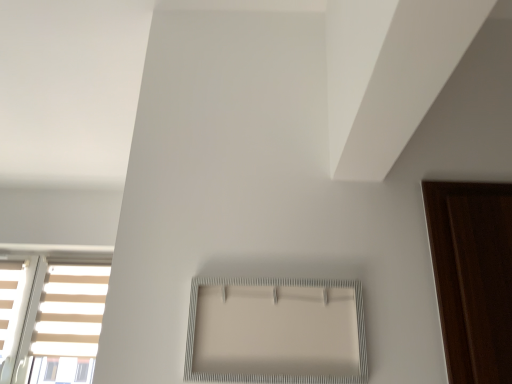
Question: Does white striped window at lower left, positioned as the 1th window in left-to-right order, come in front of white textured frame at center, which is counted as the second window, starting from the bottom?

Choices:
 (A) no
 (B) yes

Answer: (A)

Question: Can you confirm if white striped window at lower left, the 2th window viewed from the front, is smaller than white textured frame at center, which ranks as the 2th window in left-to-right order?

Choices:
 (A) yes
 (B) no

Answer: (B)

Question: Does white striped window at lower left, which is the 2th window from right to left, turn towards white textured frame at center, the 2th window from the back?

Choices:
 (A) yes
 (B) no

Answer: (B)

Question: From a real-world perspective, does white striped window at lower left, placed as the 1th window when sorted from bottom to top, sit lower than white textured frame at center, which ranks as the 2th window in left-to-right order?

Choices:
 (A) no
 (B) yes

Answer: (A)

Question: From the image's perspective, is white striped window at lower left, which is the 2th window from right to left, above white textured frame at center, which ranks as the first window in right-to-left order?

Choices:
 (A) no
 (B) yes

Answer: (A)

Question: Is white striped window at lower left, positioned as the 1th window in left-to-right order, surrounding white textured frame at center, the 2th window from the back?

Choices:
 (A) no
 (B) yes

Answer: (A)

Question: Does white matte blind at upper right have a greater width compared to white striped window at lower left, which is the 2th window from right to left?

Choices:
 (A) no
 (B) yes

Answer: (B)

Question: Could you tell me if white matte blind at upper right is turned towards white striped window at lower left, the first window positioned from the back?

Choices:
 (A) no
 (B) yes

Answer: (A)

Question: Is white matte blind at upper right positioned behind white striped window at lower left, the 2th window viewed from the front?

Choices:
 (A) no
 (B) yes

Answer: (A)

Question: Would you say white striped window at lower left, which is the 2th window from right to left, is part of white matte blind at upper right's contents?

Choices:
 (A) yes
 (B) no

Answer: (B)

Question: From the image's perspective, is white matte blind at upper right located above white striped window at lower left, the second window when ordered from top to bottom?

Choices:
 (A) no
 (B) yes

Answer: (B)

Question: From a real-world perspective, is white matte blind at upper right physically below white striped window at lower left, the second window when ordered from top to bottom?

Choices:
 (A) yes
 (B) no

Answer: (B)

Question: Is white textured frame at center, which ranks as the 2th window in left-to-right order, at the left side of white matte blind at upper right?

Choices:
 (A) no
 (B) yes

Answer: (B)